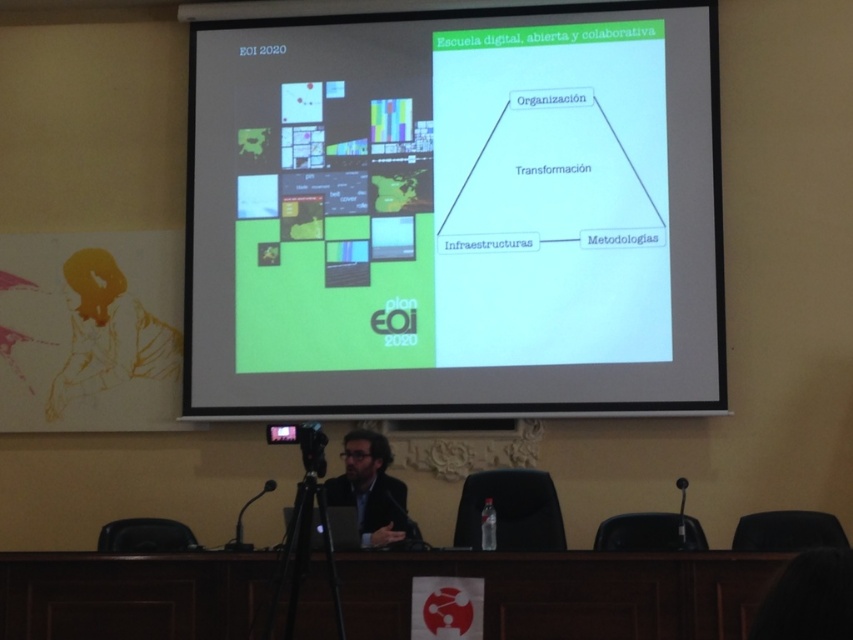
Question: Which point appears closest to the camera in this image?

Choices:
 (A) (405, 534)
 (B) (682, 496)
 (C) (397, 196)

Answer: (A)

Question: Where is white matte projector screen at upper center located in relation to dark suit at center in the image?

Choices:
 (A) right
 (B) left

Answer: (A)

Question: Which of the following is the farthest from the observer?

Choices:
 (A) dark suit at center
 (B) brown wooden table at lower center
 (C) black plastic microphone at center
 (D) white matte projector screen at upper center

Answer: (D)

Question: Which of the following is the farthest from the observer?

Choices:
 (A) white matte projector screen at upper center
 (B) black plastic microphone at center
 (C) black plastic microphone at lower left
 (D) yellow sketch at left

Answer: (D)

Question: Is white matte projector screen at upper center closer to the viewer compared to black plastic microphone at center?

Choices:
 (A) no
 (B) yes

Answer: (A)

Question: Does black plastic microphone at lower left appear on the right side of black plastic microphone at center?

Choices:
 (A) no
 (B) yes

Answer: (A)